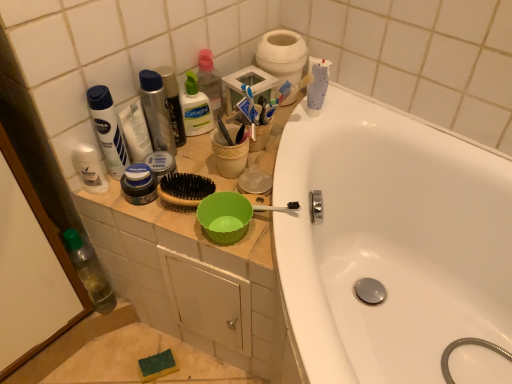
You are a GUI agent. You are given a task and a screenshot of the screen. Output one action in this format:
    pyautogui.click(x=<x>, y=<y>)
    Task: Click on the vacant space to the right of white matte toothpaste at upper right, which is the 2th toothpaste in bottom-to-top order
    This screenshot has width=512, height=384.
    Given the screenshot: What is the action you would take?
    pyautogui.click(x=370, y=117)